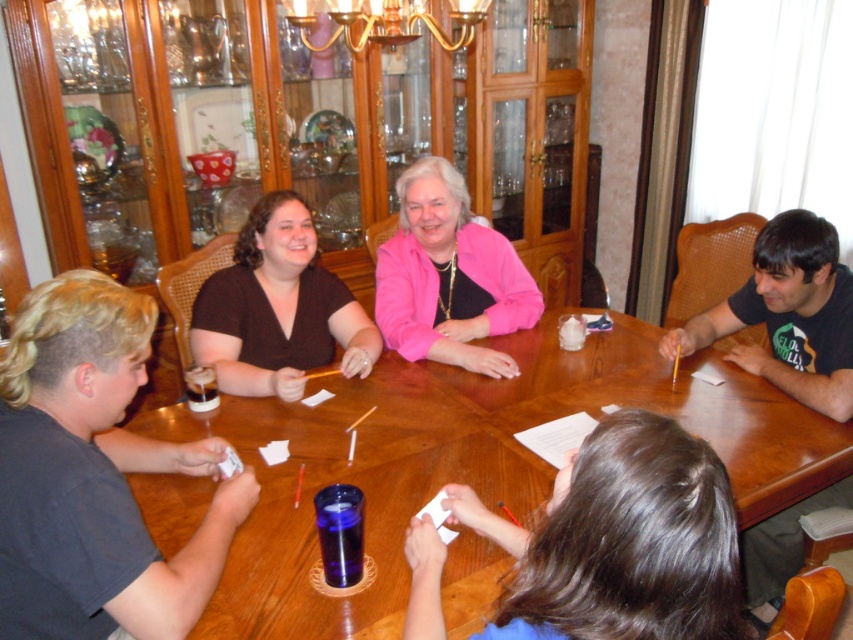
Question: Which of the following is the closest to the observer?

Choices:
 (A) (737, 612)
 (B) (297, 403)
 (C) (260, 275)
 (D) (97, 480)

Answer: (A)

Question: Can you confirm if dark brown fabric shirt at upper left is smaller than pink matte jacket at center?

Choices:
 (A) no
 (B) yes

Answer: (B)

Question: Which of the following is the closest to the observer?

Choices:
 (A) brown matte shirt at center
 (B) pink matte jacket at center
 (C) wooden table at center
 (D) dark brown fabric shirt at upper left

Answer: (D)

Question: Is dark brown fabric shirt at upper left further to the viewer compared to brown hair at lower center?

Choices:
 (A) no
 (B) yes

Answer: (B)

Question: Is dark brown fabric shirt at upper left in front of pink matte jacket at center?

Choices:
 (A) yes
 (B) no

Answer: (A)

Question: Which object is positioned closest to the wooden table at center?

Choices:
 (A) dark brown fabric shirt at upper left
 (B) brown hair at lower center

Answer: (A)